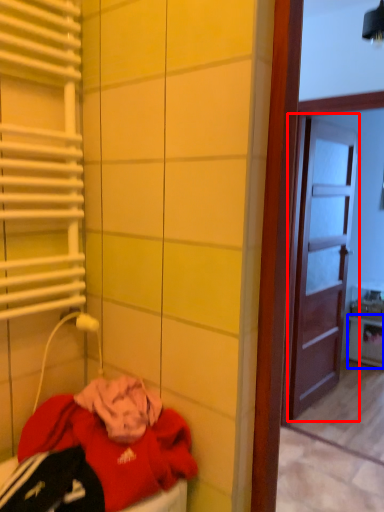
Question: Which of the following is the closest to the observer, door (highlighted by a red box) or cabinetry (highlighted by a blue box)?

Choices:
 (A) door
 (B) cabinetry

Answer: (A)